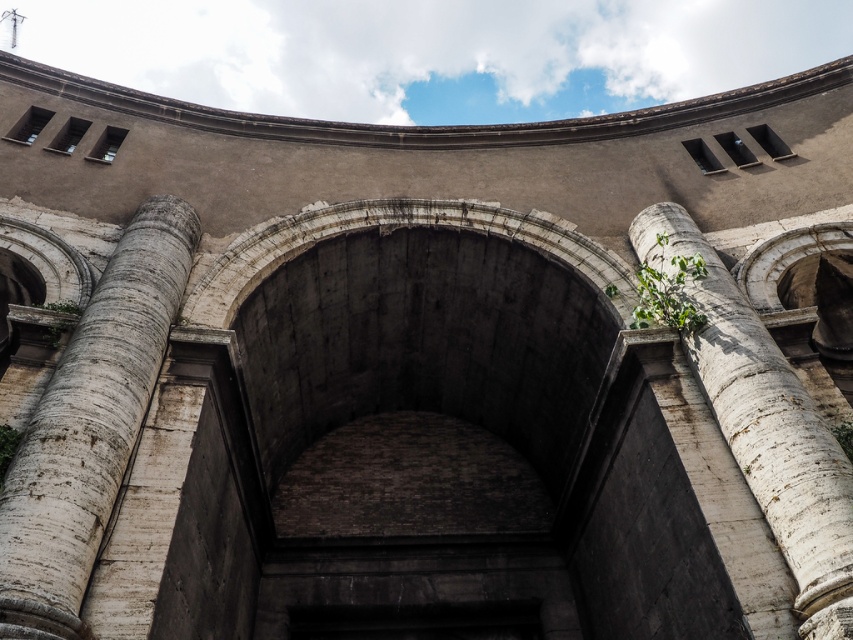
Question: Can you confirm if white marble column at center is bigger than white marble column at right?

Choices:
 (A) no
 (B) yes

Answer: (A)

Question: From the image, what is the correct spatial relationship of white marble column at center in relation to white marble column at right?

Choices:
 (A) above
 (B) below

Answer: (B)

Question: Which of the following is the closest to the observer?

Choices:
 (A) white marble column at center
 (B) white marble column at right

Answer: (A)

Question: Does white marble column at center come in front of white marble column at right?

Choices:
 (A) yes
 (B) no

Answer: (A)

Question: Among these objects, which one is nearest to the camera?

Choices:
 (A) white marble column at center
 (B) white marble column at right

Answer: (A)